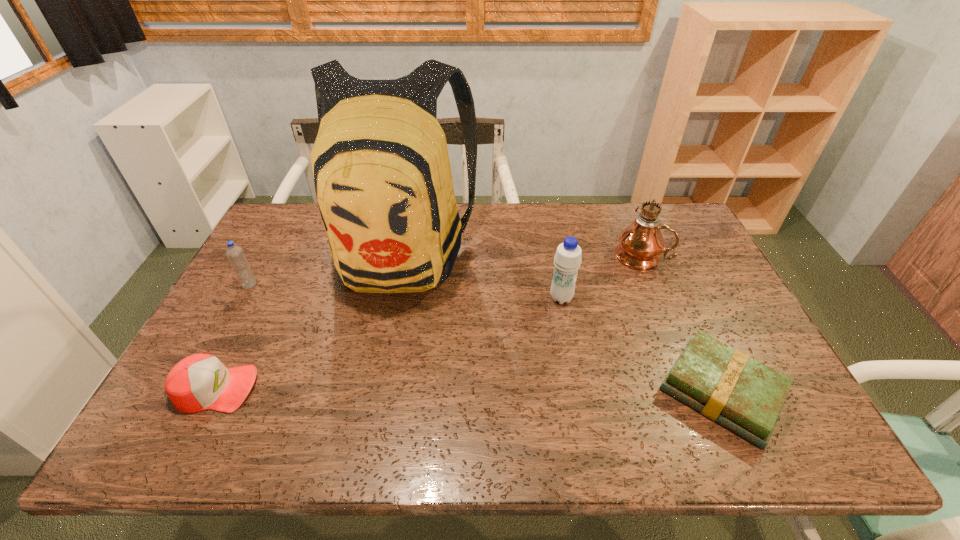
Identify the location of backpack. (382, 175).

Locate an element on the screen. the tallest object is located at coordinates (382, 175).

This screenshot has width=960, height=540. In order to click on the second tallest object in this screenshot , I will do `click(640, 244)`.

In order to click on the right water bottle in this screenshot , I will do `click(568, 257)`.

At what (x,y) coordinates should I click in order to perform the action: click on the taller water bottle. Please return your answer as a coordinate pair (x, y). This screenshot has width=960, height=540. Looking at the image, I should click on (568, 257).

This screenshot has height=540, width=960. Identify the location of the shorter water bottle. (235, 254).

This screenshot has width=960, height=540. What are the coordinates of `the left water bottle` in the screenshot? It's located at (235, 254).

This screenshot has width=960, height=540. I want to click on baseball cap, so click(x=198, y=382).

What are the coordinates of `the shortest object` in the screenshot? It's located at (725, 385).

You are a GUI agent. You are given a task and a screenshot of the screen. Output one action in this format:
    pyautogui.click(x=<x>, y=<y>)
    Task: Click on the free space located on the front-facing side of the tallest object
    The height and width of the screenshot is (540, 960).
    Given the screenshot: What is the action you would take?
    pyautogui.click(x=378, y=370)